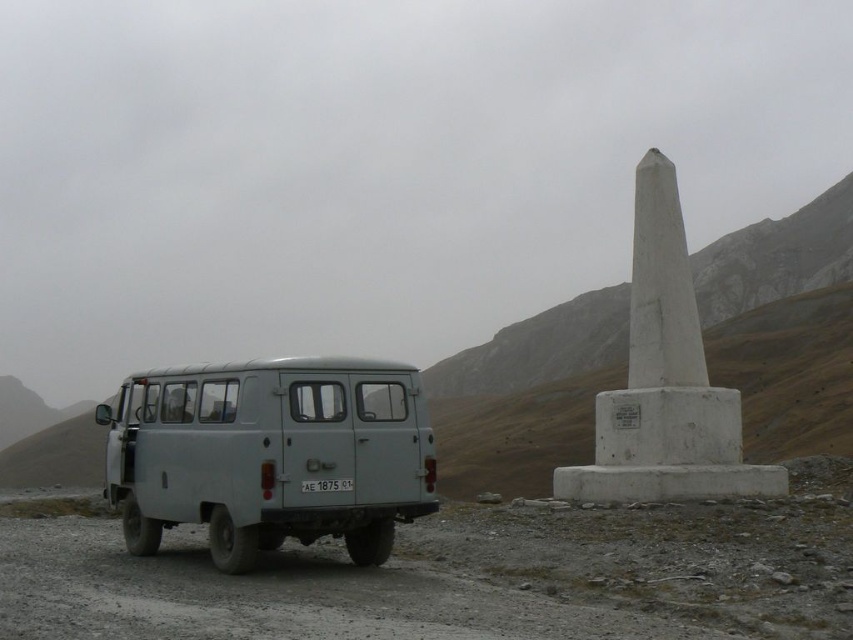
Is white concrete obelisk at right to the left of white plastic license plate at center from the viewer's perspective?

Incorrect, white concrete obelisk at right is not on the left side of white plastic license plate at center.

Can you confirm if white concrete obelisk at right is taller than white plastic license plate at center?

Correct, white concrete obelisk at right is much taller as white plastic license plate at center.

Who is more forward, (734, 394) or (338, 488)?

Point (338, 488) is in front.

Locate an element on the screen. The height and width of the screenshot is (640, 853). white concrete obelisk at right is located at coordinates (664, 381).

Who is higher up, matte gray van at left or white concrete obelisk at right?

white concrete obelisk at right

Does matte gray van at left have a smaller size compared to white concrete obelisk at right?

Yes, matte gray van at left is smaller than white concrete obelisk at right.

The height and width of the screenshot is (640, 853). In order to click on matte gray van at left in this screenshot , I will do `click(270, 454)`.

Where is `matte gray van at left`? matte gray van at left is located at coordinates (270, 454).

Does matte gray van at left have a smaller size compared to white plastic license plate at center?

Incorrect, matte gray van at left is not smaller in size than white plastic license plate at center.

Locate an element on the screen. matte gray van at left is located at coordinates pos(270,454).